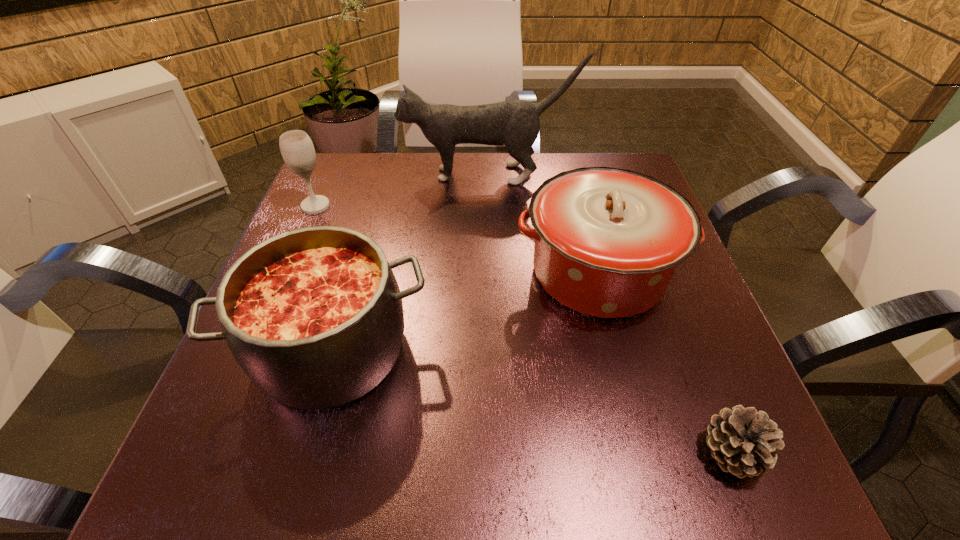
Image resolution: width=960 pixels, height=540 pixels. In order to click on free space located 0.120m on the back of the right casserole in this screenshot , I will do `click(577, 193)`.

Locate an element on the screen. vacant position located on the front of the wineglass is located at coordinates (288, 271).

Where is `free space located 0.290m on the back of the left casserole`? This screenshot has width=960, height=540. free space located 0.290m on the back of the left casserole is located at coordinates (374, 202).

Locate an element on the screen. The image size is (960, 540). vacant space located on the left of the pinecone is located at coordinates point(551,452).

I want to click on cat that is at the far edge, so click(x=515, y=124).

I want to click on wineglass present at the far edge, so click(x=297, y=149).

Where is `object that is positioned at the near edge`? The width and height of the screenshot is (960, 540). object that is positioned at the near edge is located at coordinates (x=743, y=441).

Find the location of a particular element. wineglass located at the left edge is located at coordinates (297, 149).

Where is `casserole that is positioned at the left edge`? casserole that is positioned at the left edge is located at coordinates (314, 316).

Where is `casserole at the right edge`? The height and width of the screenshot is (540, 960). casserole at the right edge is located at coordinates (607, 241).